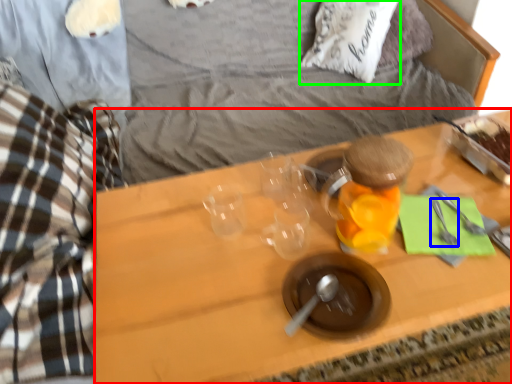
Question: Which object is positioned closest to desk (highlighted by a red box)? Select from silverware (highlighted by a blue box) and pillow (highlighted by a green box).

Choices:
 (A) silverware
 (B) pillow

Answer: (A)